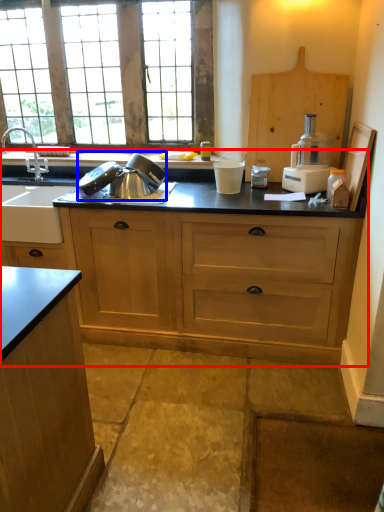
Question: Which point is closer to the camera, countertop (highlighted by a red box) or appliance (highlighted by a blue box)?

Choices:
 (A) countertop
 (B) appliance

Answer: (A)